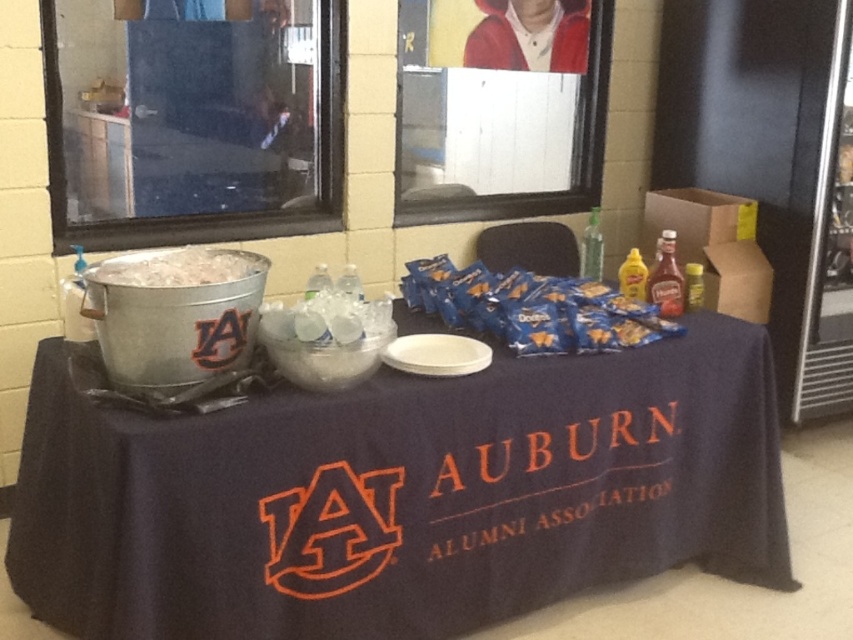
How far apart are dark blue fabric at center and blue matte doritos at center?

dark blue fabric at center and blue matte doritos at center are 17.76 inches apart from each other.

Does dark blue fabric at center have a smaller size compared to blue matte doritos at center?

Incorrect, dark blue fabric at center is not smaller in size than blue matte doritos at center.

Which is in front, point (706, 401) or point (508, 310)?

Point (508, 310) is in front.

I want to click on dark blue fabric at center, so click(x=401, y=496).

Who is more forward, (312, 550) or (119, 276)?

Point (119, 276) is in front.

Does dark blue fabric at center appear on the left side of white frosted ice at left?

No, dark blue fabric at center is not to the left of white frosted ice at left.

Between point (585, 468) and point (132, 268), which one is positioned in front?

Point (132, 268)

Where is `dark blue fabric at center`? dark blue fabric at center is located at coordinates (401, 496).

Which is in front, point (640, 312) or point (177, 257)?

Point (177, 257)

Is blue matte doritos at center shorter than white frosted ice at left?

In fact, blue matte doritos at center may be taller than white frosted ice at left.

Is point (619, 337) less distant than point (202, 273)?

No, it is behind (202, 273).

At what (x,y) coordinates should I click in order to perform the action: click on blue matte doritos at center. Please return your answer as a coordinate pair (x, y). The image size is (853, 640). Looking at the image, I should click on pyautogui.click(x=532, y=308).